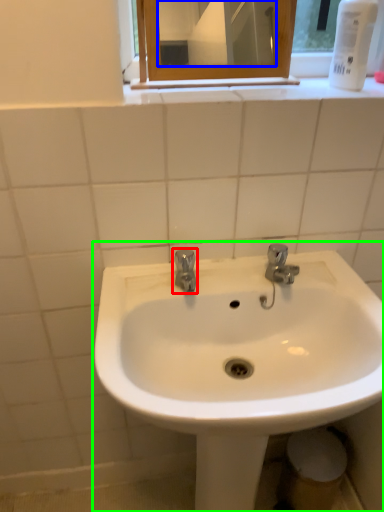
Question: Based on their relative distances, which object is farther from tap (highlighted by a red box)? Choose from mirror (highlighted by a blue box) and sink (highlighted by a green box).

Choices:
 (A) mirror
 (B) sink

Answer: (A)